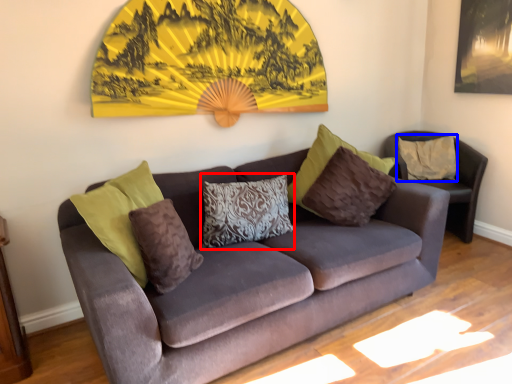
Question: Which point is closer to the camera, pillow (highlighted by a red box) or pillow (highlighted by a blue box)?

Choices:
 (A) pillow
 (B) pillow

Answer: (A)